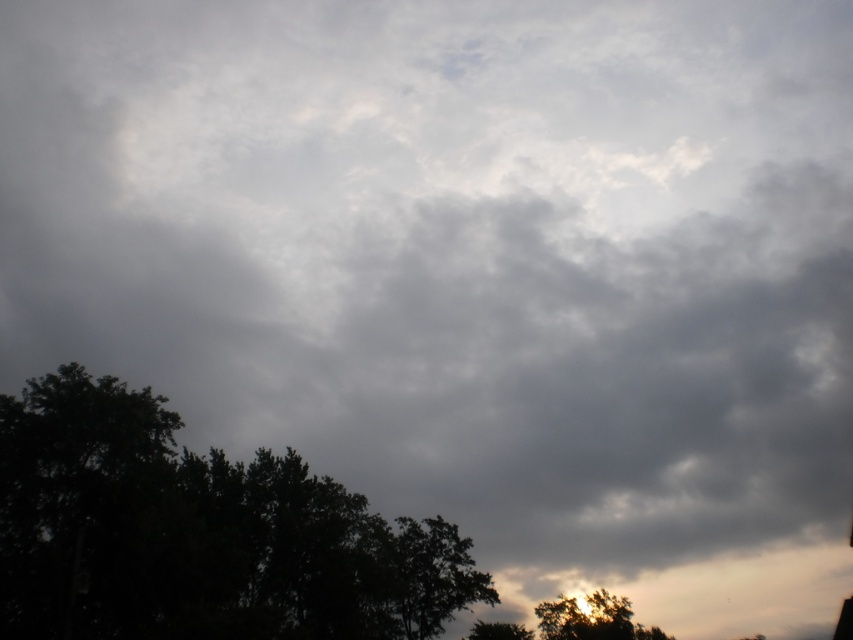
Question: Considering the real-world distances, which object is closest to the golden textured tree at lower right?

Choices:
 (A) green leafy tree at lower center
 (B) green leafy tree at lower left

Answer: (A)

Question: Which of the following is the closest to the observer?

Choices:
 (A) pos(177,561)
 (B) pos(595,609)

Answer: (A)

Question: Which point is closer to the camera?

Choices:
 (A) click(614, 618)
 (B) click(247, 531)

Answer: (B)

Question: Can you confirm if green leafy tree at lower left is bigger than green leafy tree at lower center?

Choices:
 (A) no
 (B) yes

Answer: (B)

Question: Does golden textured tree at lower right have a smaller size compared to green leafy tree at lower center?

Choices:
 (A) yes
 (B) no

Answer: (B)

Question: From the image, what is the correct spatial relationship of green leafy tree at lower left in relation to green leafy tree at lower center?

Choices:
 (A) below
 (B) above

Answer: (B)